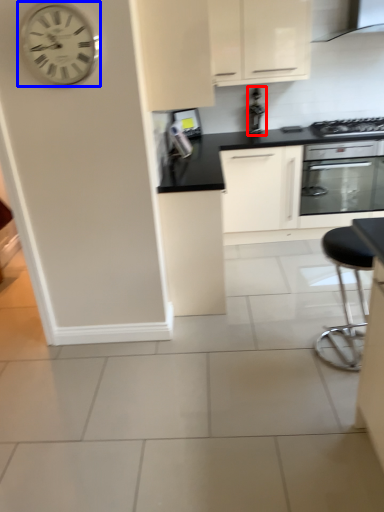
Question: Which object is further to the camera taking this photo, appliance (highlighted by a red box) or wall clock (highlighted by a blue box)?

Choices:
 (A) appliance
 (B) wall clock

Answer: (A)